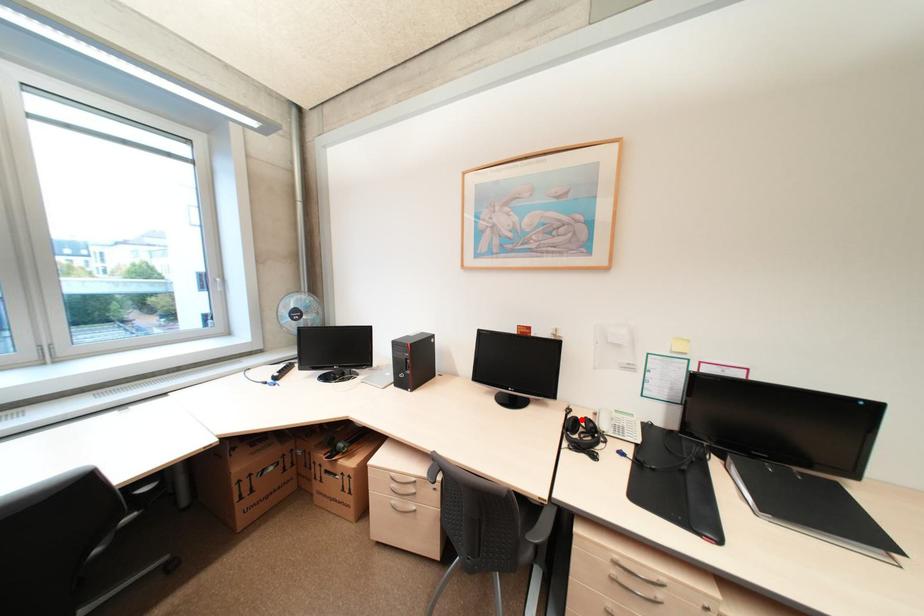
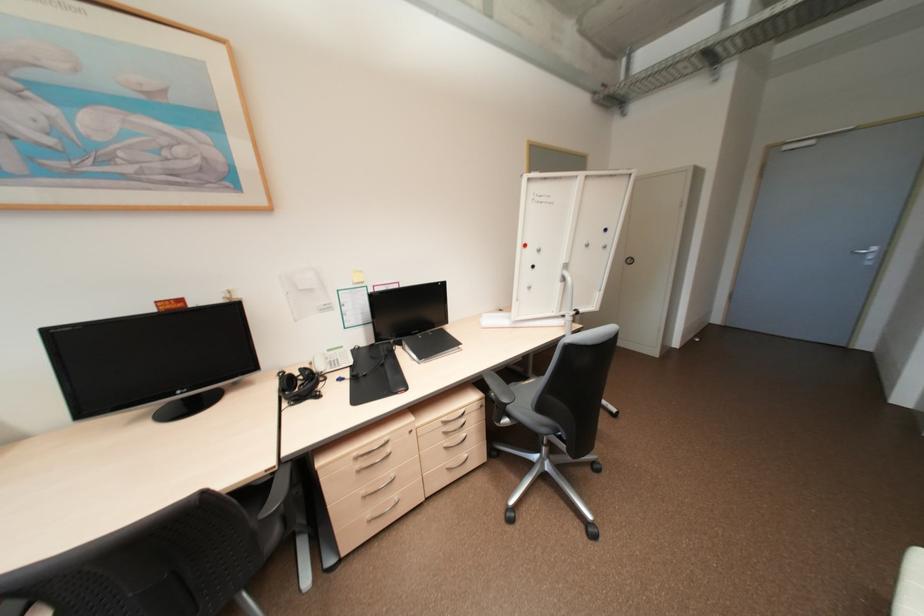
Where in the second image is the point corresponding to the highlighted location from the first image?

(297, 377)